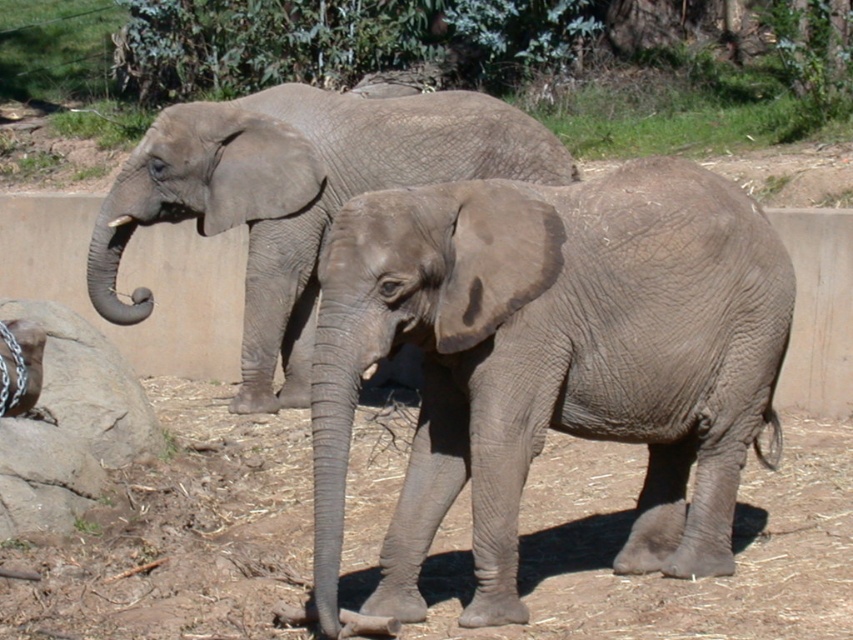
You are standing in the zoo enclosure and want to place a small toy on the ground near the brown dirt at lower center. What coordinate should you use to place the toy?

You should place the toy at the coordinate point (x=663, y=577) where the brown dirt at lower center is located.

You are a zookeeper standing at the origin point of the image coordinate system. You need to locate the gray matte elephant at center. What are its coordinates?

The gray matte elephant at center is located at coordinates point [550,360].